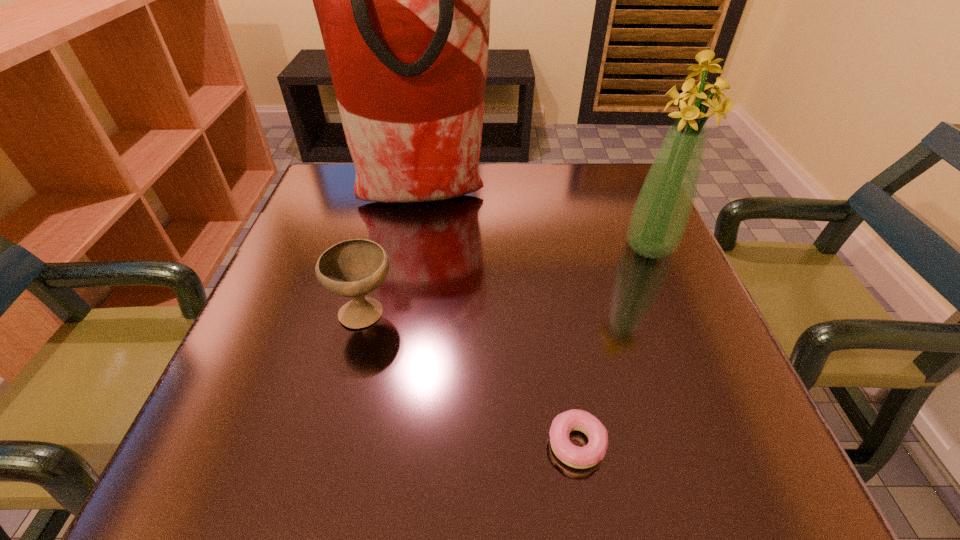
Where is `grocery bag`? The image size is (960, 540). grocery bag is located at coordinates (403, 0).

Identify the location of the tallest object. This screenshot has width=960, height=540. (403, 0).

You are a GUI agent. You are given a task and a screenshot of the screen. Output one action in this format:
    pyautogui.click(x=<x>, y=<y>)
    Task: Click on the second farthest object
    Image resolution: width=960 pixels, height=540 pixels.
    Given the screenshot: What is the action you would take?
    pyautogui.click(x=659, y=218)

Identify the location of the second tallest object. Image resolution: width=960 pixels, height=540 pixels. (659, 218).

Where is `the third tallest object`? This screenshot has width=960, height=540. the third tallest object is located at coordinates (353, 268).

Find the location of a particular element. The image size is (960, 540). the third farthest object is located at coordinates (353, 268).

Find the location of a particular element. Image resolution: width=960 pixels, height=540 pixels. the shortest object is located at coordinates (574, 456).

The height and width of the screenshot is (540, 960). I want to click on doughnut, so click(x=574, y=456).

The width and height of the screenshot is (960, 540). I want to click on free spot located 0.150m on the front of the tallest object, so click(412, 267).

You are a GUI agent. You are given a task and a screenshot of the screen. Output one action in this format:
    pyautogui.click(x=<x>, y=<y>)
    Task: Click on the free space located 0.230m on the front-facing side of the rightmost object
    
    Given the screenshot: What is the action you would take?
    pyautogui.click(x=697, y=357)